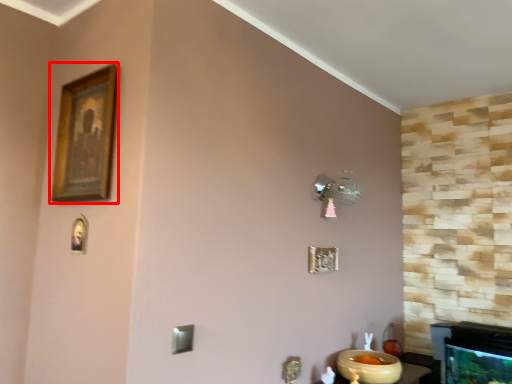
Question: Where is picture frame (annotated by the red box) located in relation to glass bowl in the image?

Choices:
 (A) right
 (B) left

Answer: (B)